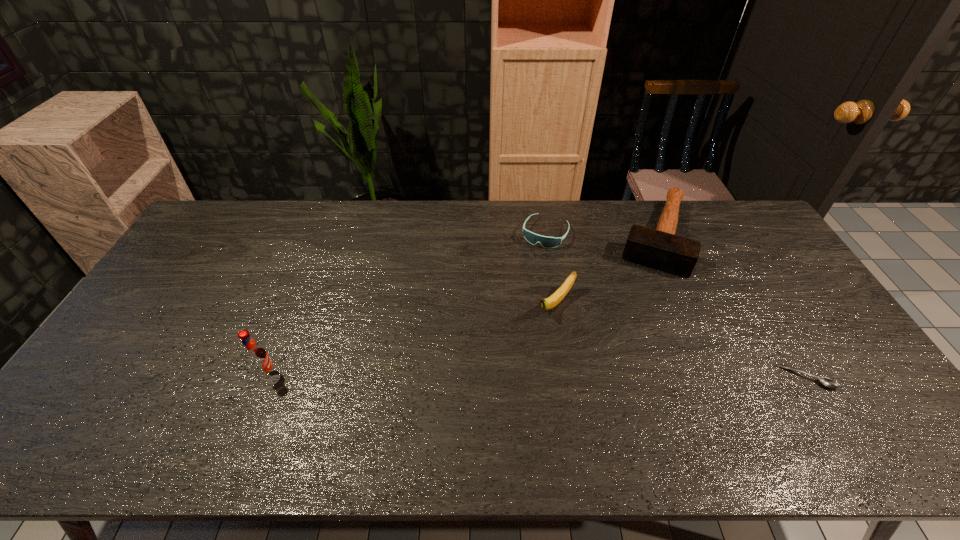
Locate an element on the screen. Image resolution: width=960 pixels, height=540 pixels. object at the near edge is located at coordinates (827, 382).

Identify the location of object situated at the right edge. (827, 382).

Image resolution: width=960 pixels, height=540 pixels. What are the coordinates of `object that is at the near right corner` in the screenshot? It's located at (827, 382).

This screenshot has height=540, width=960. In order to click on vacant space at the far edge of the desktop in this screenshot , I will do `click(284, 210)`.

This screenshot has width=960, height=540. What are the coordinates of `vacant space at the near edge of the desktop` in the screenshot? It's located at (641, 398).

Find the location of a particular element. This screenshot has height=540, width=960. vacant space at the left edge of the desktop is located at coordinates (x=135, y=370).

Where is `vacant space at the far left corner of the desktop`? vacant space at the far left corner of the desktop is located at coordinates (230, 229).

I want to click on free region at the far right corner of the desktop, so click(709, 209).

Locate an element on the screen. This screenshot has height=540, width=960. vacant area that lies between the shortest object and the third nearest object is located at coordinates (682, 340).

Image resolution: width=960 pixels, height=540 pixels. I want to click on vacant area that lies between the shortest object and the banana, so click(682, 340).